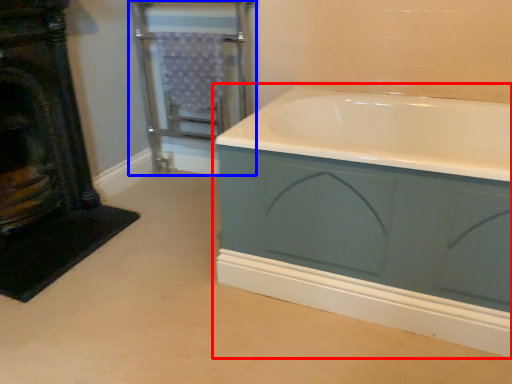
Question: Which of the following is the farthest to the observer, bathtub (highlighted by a red box) or screen door (highlighted by a blue box)?

Choices:
 (A) bathtub
 (B) screen door

Answer: (B)